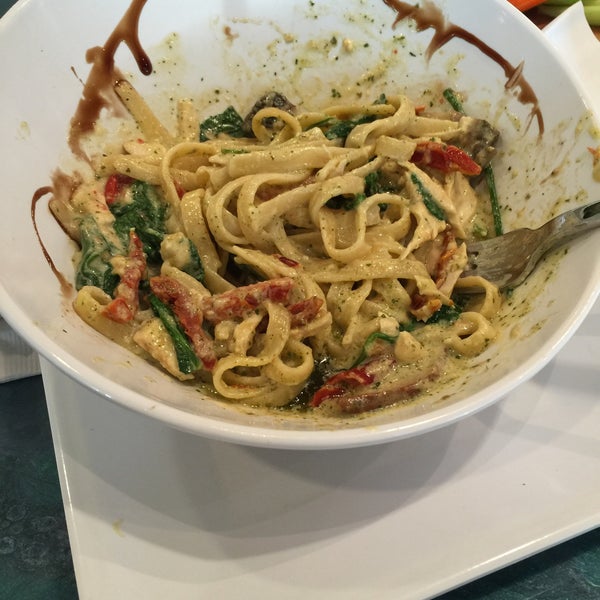
In order to click on fork in this screenshot , I will do `click(506, 255)`.